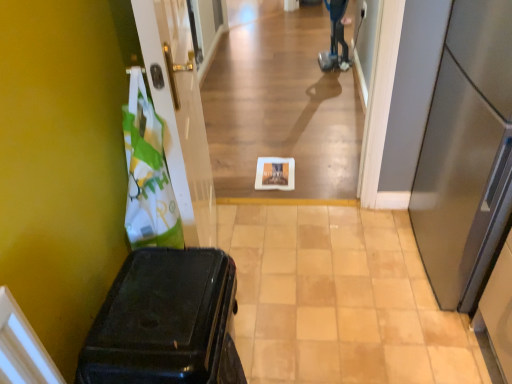
Question: Is white glossy plate at center at the left side of blue plastic mobility scooter at upper center?

Choices:
 (A) no
 (B) yes

Answer: (B)

Question: Is white glossy plate at center closer to the viewer compared to blue plastic mobility scooter at upper center?

Choices:
 (A) yes
 (B) no

Answer: (A)

Question: From the image's perspective, would you say white glossy plate at center is shown under blue plastic mobility scooter at upper center?

Choices:
 (A) no
 (B) yes

Answer: (B)

Question: Is white glossy plate at center shorter than blue plastic mobility scooter at upper center?

Choices:
 (A) yes
 (B) no

Answer: (A)

Question: Can you confirm if white glossy plate at center is bigger than blue plastic mobility scooter at upper center?

Choices:
 (A) yes
 (B) no

Answer: (B)

Question: Would you say shiny black suitcase at left is to the left or to the right of satin silver refrigerator at right, acting as the 1th door starting from the right, in the picture?

Choices:
 (A) right
 (B) left

Answer: (B)

Question: From their relative heights in the image, would you say shiny black suitcase at left is taller or shorter than satin silver refrigerator at right, the second door when ordered from left to right?

Choices:
 (A) short
 (B) tall

Answer: (A)

Question: Considering their positions, is shiny black suitcase at left located in front of or behind satin silver refrigerator at right, acting as the 1th door starting from the right?

Choices:
 (A) behind
 (B) front

Answer: (B)

Question: From the image's perspective, is shiny black suitcase at left located above or below satin silver refrigerator at right, acting as the 1th door starting from the right?

Choices:
 (A) below
 (B) above

Answer: (A)

Question: Is blue plastic mobility scooter at upper center inside the boundaries of white glossy door at left, which is the 2th door from right to left, or outside?

Choices:
 (A) outside
 (B) inside

Answer: (A)

Question: Considering the relative positions of blue plastic mobility scooter at upper center and white glossy door at left, which appears as the 1th door when viewed from the left, in the image provided, is blue plastic mobility scooter at upper center to the left or to the right of white glossy door at left, which appears as the 1th door when viewed from the left,?

Choices:
 (A) left
 (B) right

Answer: (B)

Question: Considering their positions, is blue plastic mobility scooter at upper center located in front of or behind white glossy door at left, which is the 2th door from right to left?

Choices:
 (A) front
 (B) behind

Answer: (B)

Question: Considering the positions of blue plastic mobility scooter at upper center and white glossy door at left, which is the 2th door from right to left, in the image, is blue plastic mobility scooter at upper center bigger or smaller than white glossy door at left, which is the 2th door from right to left,?

Choices:
 (A) big
 (B) small

Answer: (B)

Question: Is blue plastic mobility scooter at upper center situated inside white glossy plate at center or outside?

Choices:
 (A) outside
 (B) inside

Answer: (A)

Question: From a real-world perspective, is blue plastic mobility scooter at upper center above or below white glossy plate at center?

Choices:
 (A) above
 (B) below

Answer: (A)